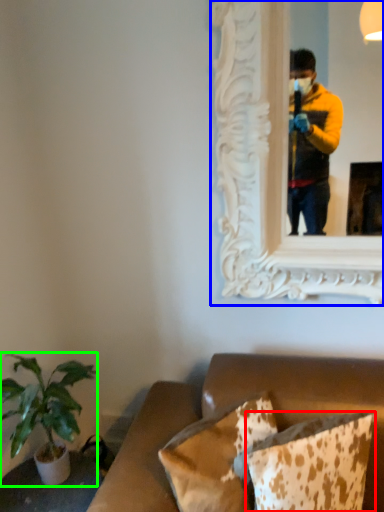
Question: Estimate the real-world distances between objects in this image. Which object is farther from pillow (highlighted by a red box), picture frame (highlighted by a blue box) or houseplant (highlighted by a green box)?

Choices:
 (A) picture frame
 (B) houseplant

Answer: (A)